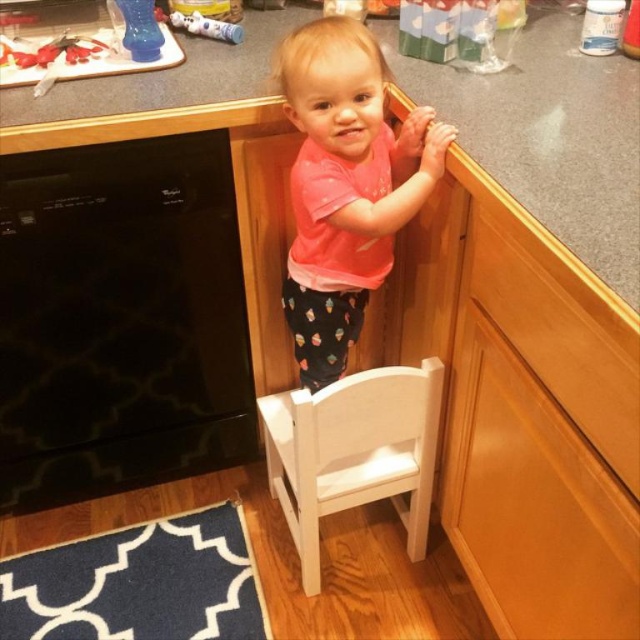
You are a toy robot that is 25 centimeters wide. You are currently standing next to the white wooden chair at lower center and want to move to the pink matte shirt at center. Can you fit through the space between them without moving either object?

The distance between the pink matte shirt at center and the white wooden chair at lower center is 27.80 centimeters. Since the robot is 25 centimeters wide, it can fit through the space as 27.80 cm is greater than 25 cm.

The child is trying to reach the oven controls located on the black glossy oven at left. Considering the position of the pink matte shirt at center, can the child reach the controls?

The black glossy oven at left is below the pink matte shirt at center, which means the oven is lower in position. Since the oven is positioned lower, the child can likely reach the controls.

You are helping a child in the kitchen. The child wants to place a small toy on the black glossy oven at left and the gray matte counter top at upper center. Which surface can fit the toy better?

The gray matte counter top at upper center can fit the toy better because it occupies more space than the black glossy oven at left.